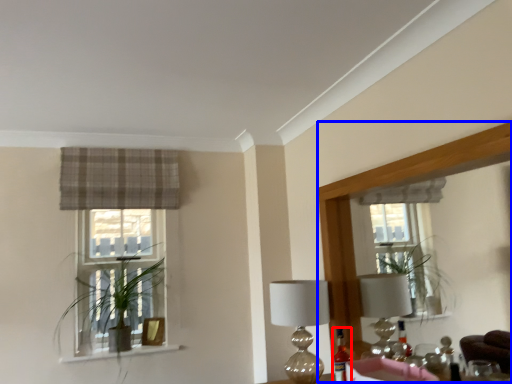
Question: Which of the following is the farthest to the observer, bottle (highlighted by a red box) or mirror (highlighted by a blue box)?

Choices:
 (A) bottle
 (B) mirror

Answer: (A)